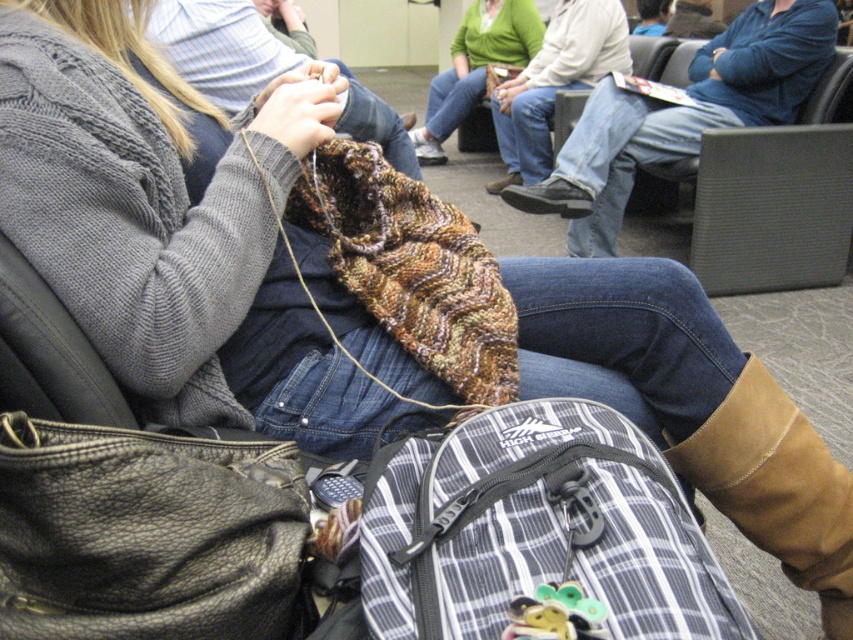
Between black leather bag at lower left and jeans at center, which one appears on the right side from the viewer's perspective?

jeans at center is more to the right.

Based on the photo, who is positioned more to the left, black leather bag at lower left or jeans at center?

black leather bag at lower left is more to the left.

Which is in front, point (15, 602) or point (520, 102)?

Point (15, 602) is in front.

Where is `black leather bag at lower left`? black leather bag at lower left is located at coordinates (144, 532).

From the picture: Does blue jeans at center appear on the right side of green knitted sweater at center?

Indeed, blue jeans at center is positioned on the right side of green knitted sweater at center.

Is point (720, 106) less distant than point (494, 52)?

Yes.

Locate an element on the screen. The width and height of the screenshot is (853, 640). blue jeans at center is located at coordinates (682, 116).

Can you confirm if jeans at center is smaller than green knitted sweater at center?

Yes.

Between jeans at center and green knitted sweater at center, which one is positioned higher?

green knitted sweater at center is above.

Does point (606, 44) lie behind point (473, 60)?

No, it is not.

Where is `jeans at center`? jeans at center is located at coordinates (555, 83).